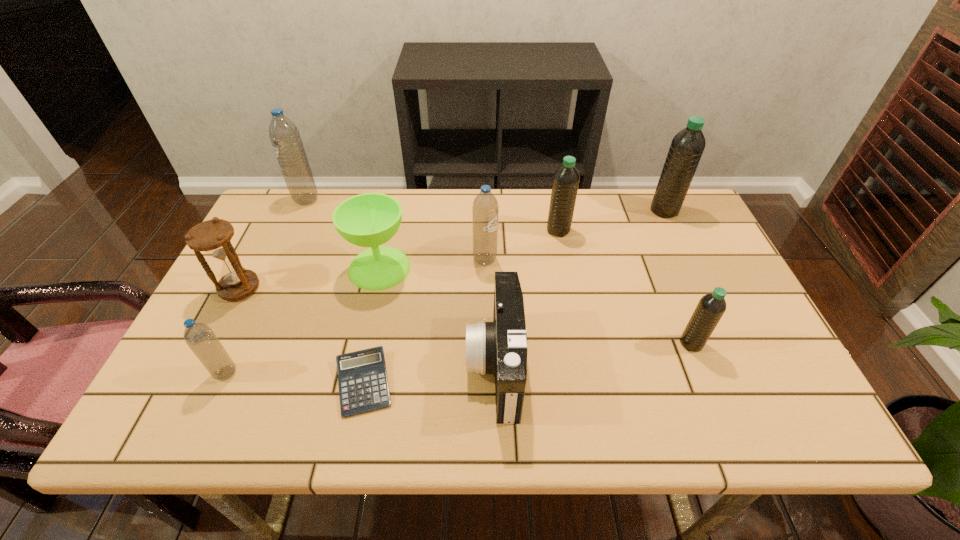
I want to click on vacant space located 0.070m on the right of the green wineglass, so click(436, 268).

Locate an element on the screen. vacant space located 0.100m on the right of the second water bottle from right to left is located at coordinates (745, 343).

Locate an element on the screen. vacant region located on the front of the nearest blue water bottle is located at coordinates (207, 413).

You are a GUI agent. You are given a task and a screenshot of the screen. Output one action in this format:
    pyautogui.click(x=<x>, y=<y>)
    Task: Click on the vacant area located 0.210m on the lens of the black camcorder
    This screenshot has width=960, height=540.
    Given the screenshot: What is the action you would take?
    pyautogui.click(x=373, y=366)

I want to click on vacant space located on the lens of the black camcorder, so click(414, 366).

Image resolution: width=960 pixels, height=540 pixels. I want to click on free space located on the lens of the black camcorder, so click(x=444, y=366).

The height and width of the screenshot is (540, 960). Identify the location of free point located 0.320m on the left of the calculator. (185, 383).

Find the location of a particular element. camcorder located at the near edge is located at coordinates (500, 347).

What are the coordinates of `calculator present at the near edge` in the screenshot? It's located at (362, 376).

Find the location of a particular element. hourglass positioned at the left edge is located at coordinates (213, 237).